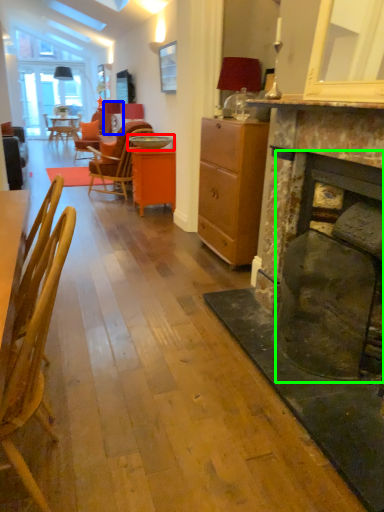
Question: Which object is positioned farthest from round table (highlighted by a red box)? Select from lamp (highlighted by a blue box) and fireplace (highlighted by a green box).

Choices:
 (A) lamp
 (B) fireplace

Answer: (B)